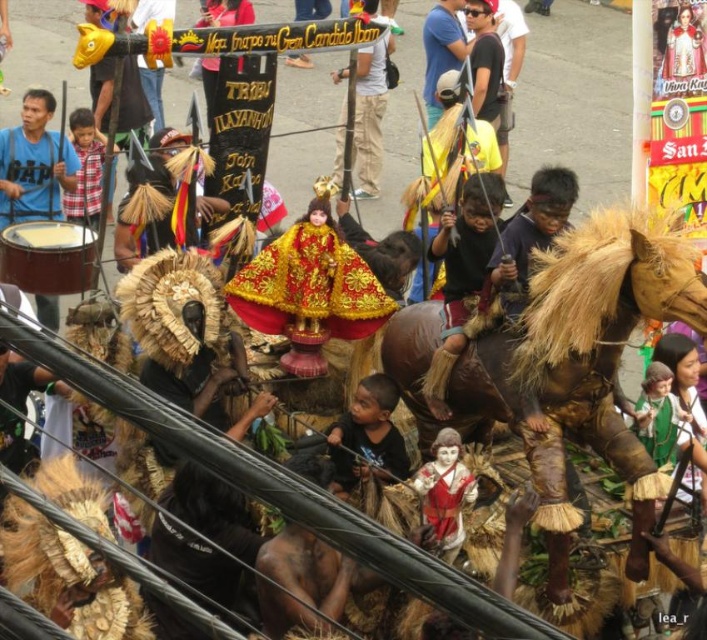
Is matte gold helmet at center behind blue cotton shirt at upper center?

No, it is not.

Between matte gold helmet at center and blue cotton shirt at upper center, which one has more height?

Standing taller between the two is matte gold helmet at center.

Describe the element at coordinates (370, 113) in the screenshot. I see `matte gold helmet at center` at that location.

Locate an element on the screen. This screenshot has width=707, height=640. matte gold helmet at center is located at coordinates (370, 113).

Between smooth brown drum at left and blue cotton shirt at upper center, which one has more height?

blue cotton shirt at upper center is taller.

Is point (28, 289) positioned in front of point (426, 54)?

Yes, point (28, 289) is closer to viewer.

Where is `smooth brown drum at left`? This screenshot has height=640, width=707. smooth brown drum at left is located at coordinates (47, 257).

Is smooth brown drum at left positioned before matte gold helmet at center?

Yes, smooth brown drum at left is closer to the viewer.

Image resolution: width=707 pixels, height=640 pixels. Describe the element at coordinates (47, 257) in the screenshot. I see `smooth brown drum at left` at that location.

This screenshot has height=640, width=707. What do you see at coordinates (47, 257) in the screenshot? I see `smooth brown drum at left` at bounding box center [47, 257].

Identify the location of smooth brown drum at left. The height and width of the screenshot is (640, 707). (47, 257).